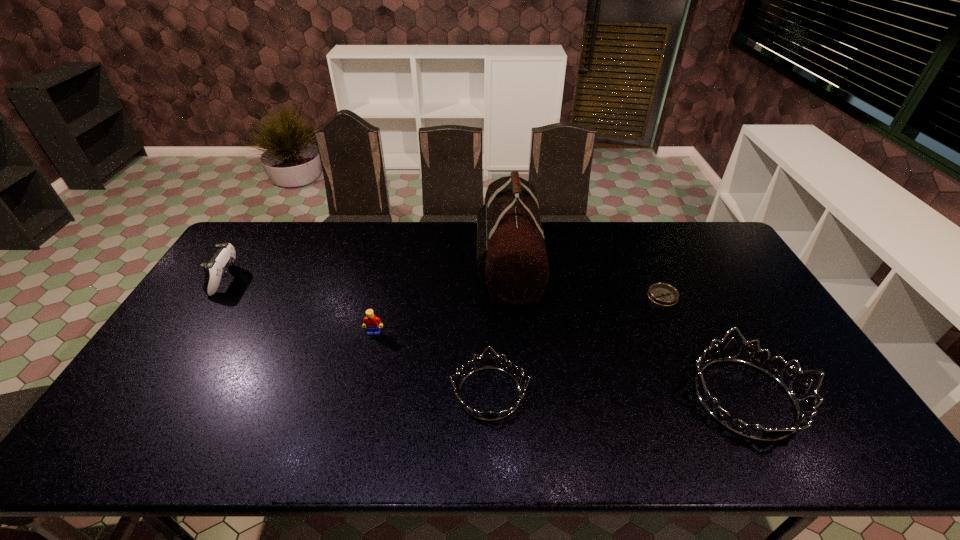
Find the location of `object that is at the near right corner`. object that is at the near right corner is located at coordinates (797, 389).

This screenshot has height=540, width=960. Find the location of `blank area at the far edge`. blank area at the far edge is located at coordinates (613, 245).

This screenshot has height=540, width=960. In the image, there is a desktop. Identify the location of free space at the near edge. (735, 414).

Locate an element on the screen. The width and height of the screenshot is (960, 540). vacant region at the left edge is located at coordinates (202, 350).

The height and width of the screenshot is (540, 960). In the image, there is a desktop. In order to click on free space at the far right corner in this screenshot , I will do `click(707, 227)`.

Find the location of a particular element. vacant space that is in between the taller tiara and the duffel bag is located at coordinates (627, 331).

Identify the location of free space between the shorter tiara and the shortest object. The width and height of the screenshot is (960, 540). (576, 345).

Find the location of a particular element. free spot between the taller tiara and the Lego is located at coordinates (560, 366).

Where is `vacant area between the taller tiara and the shortest object`? The height and width of the screenshot is (540, 960). vacant area between the taller tiara and the shortest object is located at coordinates (704, 347).

What are the coordinates of `vacant space that is in between the duffel bag and the second object from left to right` in the screenshot? It's located at (442, 299).